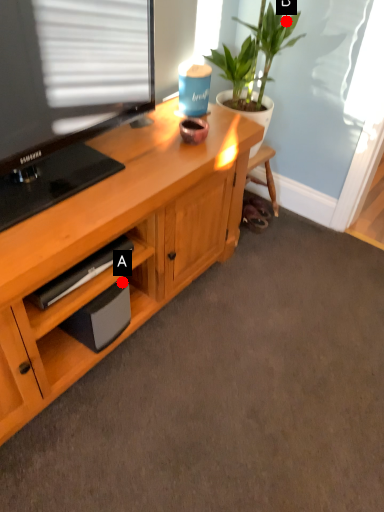
Question: Two points are circled on the image, labeled by A and B beside each circle. Among these points, which one is farthest from the camera?

Choices:
 (A) A is further
 (B) B is further

Answer: (B)